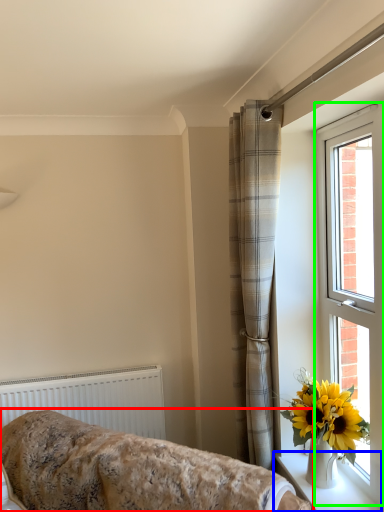
Question: Which is nearer to the furniture (highlighted by a red box)? window sill (highlighted by a blue box) or window (highlighted by a green box).

Choices:
 (A) window sill
 (B) window

Answer: (A)